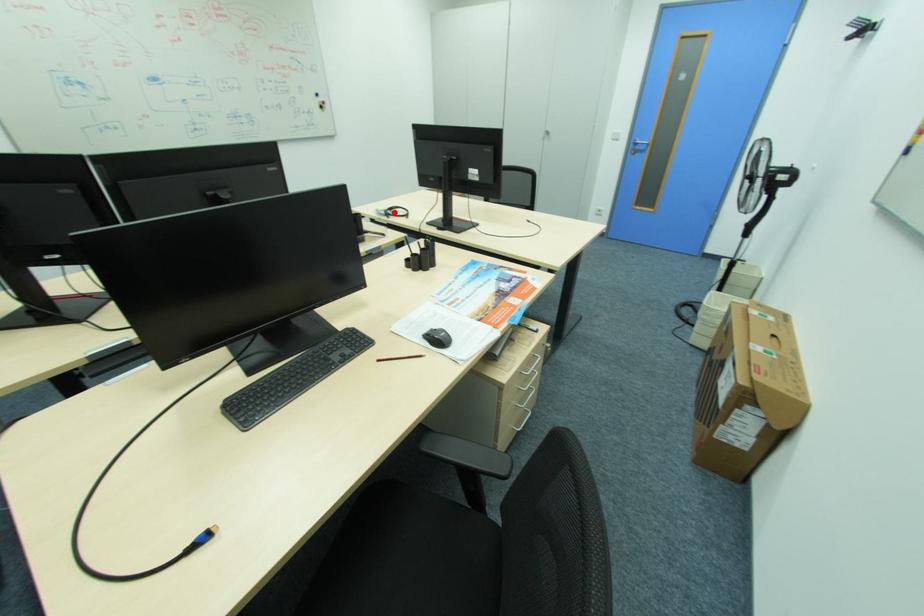
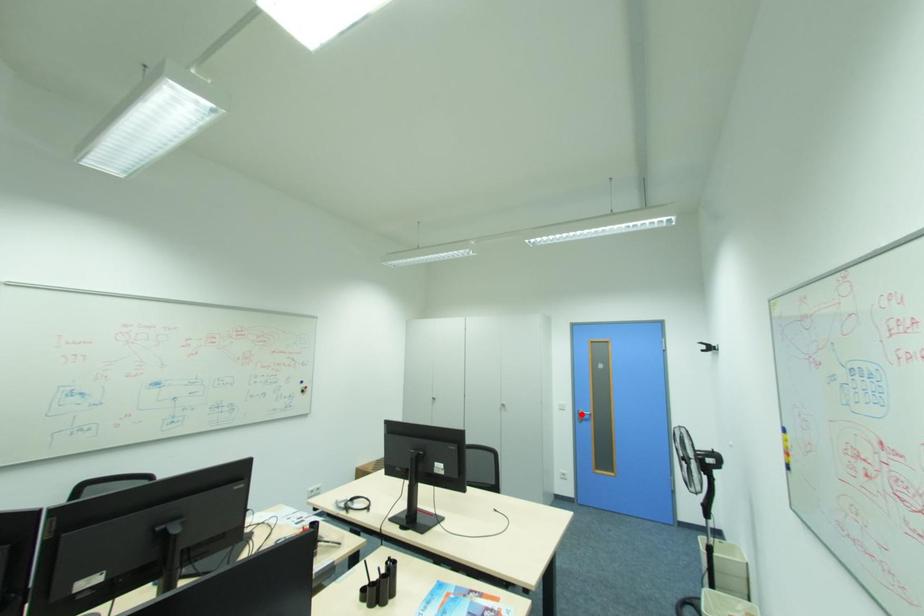
I am providing you with two images of the same scene from different viewpoints. A red point is marked on the first image and another point is marked on the second image. Is the marked point in image1 the same physical position as the marked point in image2?

No